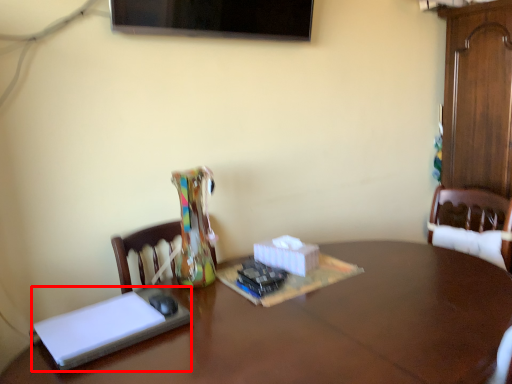
Question: From the image's perspective, where is book (annotated by the red box) located in relation to table in the image?

Choices:
 (A) above
 (B) below

Answer: (A)